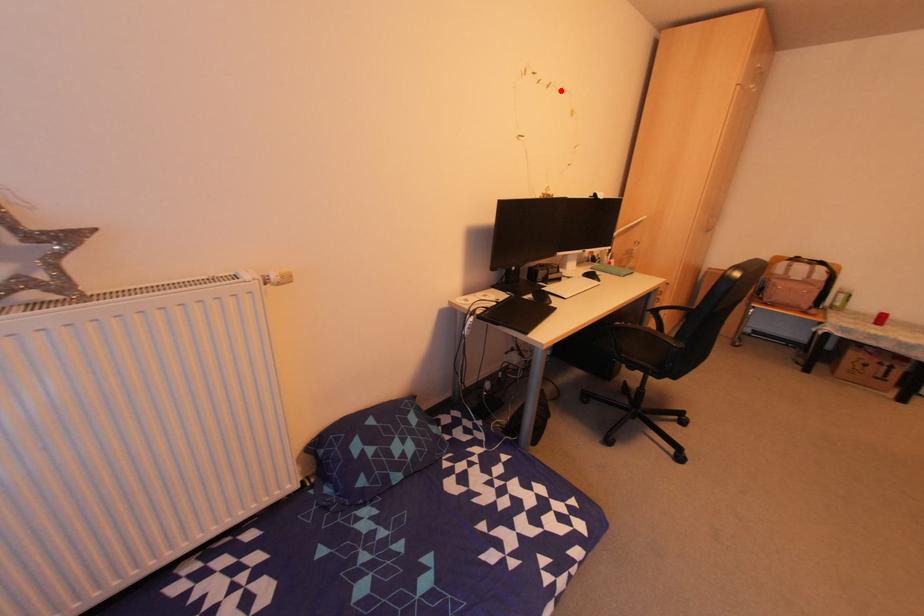
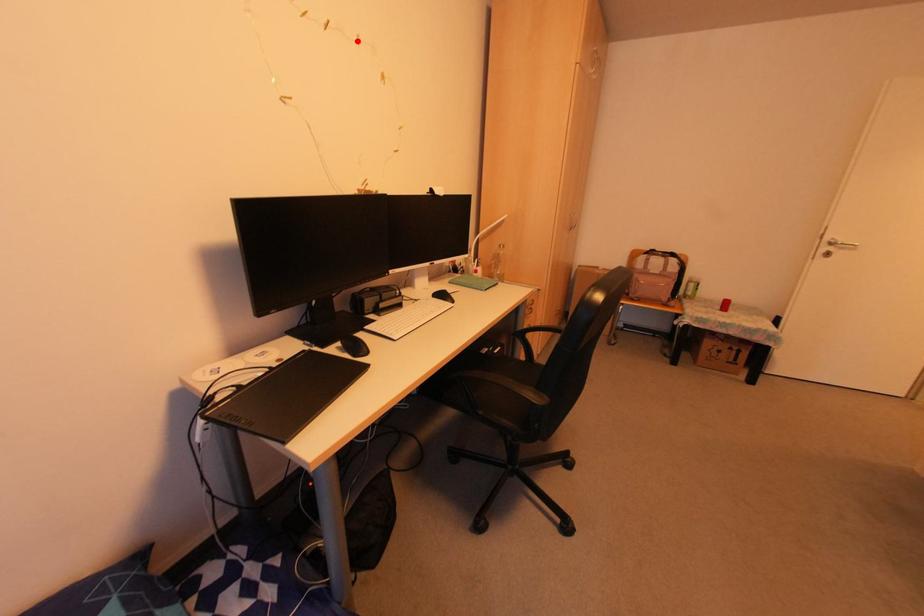
I am providing you with two images of the same scene from different viewpoints. A red point is marked on the first image and another point is marked on the second image. Is the marked point in image1 the same physical position as the marked point in image2?

Yes